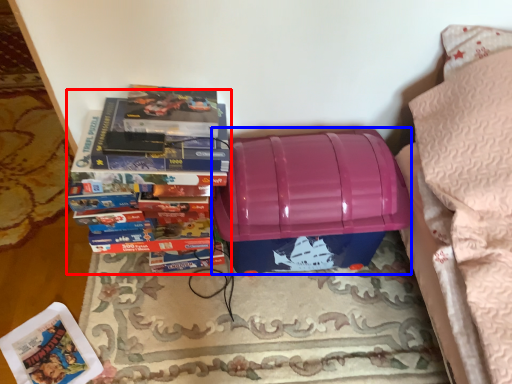
Question: Which point is closer to the camera, book (highlighted by a red box) or storage box (highlighted by a blue box)?

Choices:
 (A) book
 (B) storage box

Answer: (A)